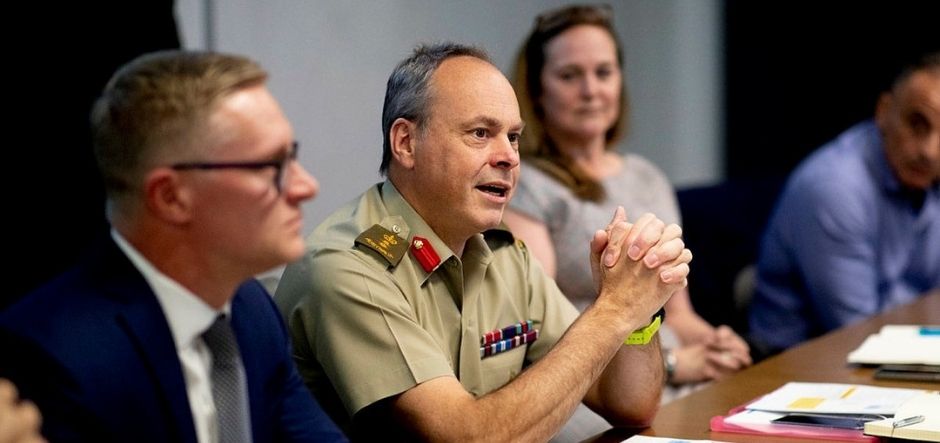
At what (x,y) coordinates should I click in order to perform the action: click on wall. Please return your answer as a coordinate pair (x, y). This screenshot has height=443, width=940. Looking at the image, I should click on (349, 76).